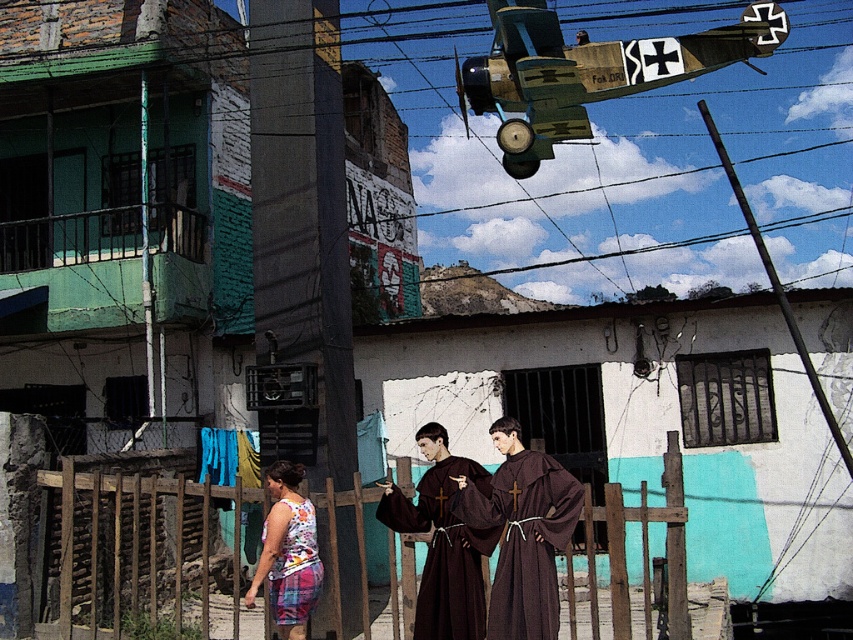
Question: Which object appears farthest from the camera in this image?

Choices:
 (A) brown woolen robe at center
 (B) printed fabric dress at lower center

Answer: (A)

Question: Among these objects, which one is nearest to the camera?

Choices:
 (A) printed fabric dress at lower center
 (B) brown woolen robes at center
 (C) brown woolen robe at center
 (D) camouflage fabric plane at upper right

Answer: (A)

Question: Is camouflage fabric plane at upper right further to the viewer compared to printed fabric dress at lower center?

Choices:
 (A) no
 (B) yes

Answer: (B)

Question: Is camouflage fabric plane at upper right positioned behind printed fabric dress at lower center?

Choices:
 (A) yes
 (B) no

Answer: (A)

Question: Considering the real-world distances, which object is farthest from the camouflage fabric plane at upper right?

Choices:
 (A) printed fabric dress at lower center
 (B) brown woolen robes at center
 (C) brown woolen robe at center

Answer: (A)

Question: Can you confirm if brown woolen robe at center is positioned above printed fabric dress at lower center?

Choices:
 (A) yes
 (B) no

Answer: (B)